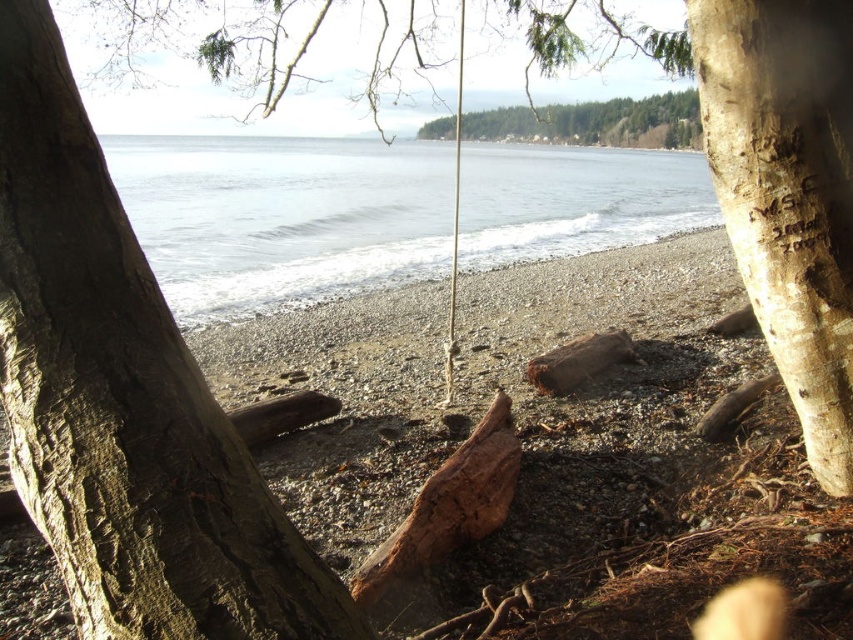
Can you confirm if brown rough bark at center is taller than green textured forest at upper center?

In fact, brown rough bark at center may be shorter than green textured forest at upper center.

Between point (41, 160) and point (544, 125), which one is positioned behind?

Point (544, 125)

You are a GUI agent. You are given a task and a screenshot of the screen. Output one action in this format:
    pyautogui.click(x=<x>, y=<y>)
    Task: Click on the brown rough bark at center
    Image resolution: width=853 pixels, height=640 pixels.
    Given the screenshot: What is the action you would take?
    click(125, 400)

Is smooth brown driftwood at center thinner than light brown bark tree trunk at right?

Incorrect, smooth brown driftwood at center's width is not less than light brown bark tree trunk at right's.

Can you confirm if smooth brown driftwood at center is smaller than light brown bark tree trunk at right?

No.

Locate an element on the screen. smooth brown driftwood at center is located at coordinates (554, 445).

Can you confirm if smooth brown driftwood at center is taller than brown rough bark at center?

Yes.

Does smooth brown driftwood at center have a smaller size compared to brown rough bark at center?

No, smooth brown driftwood at center is not smaller than brown rough bark at center.

Which is in front, point (718, 349) or point (49, 372)?

Point (49, 372) is more forward.

Where is `smooth brown driftwood at center`? The height and width of the screenshot is (640, 853). smooth brown driftwood at center is located at coordinates (554, 445).